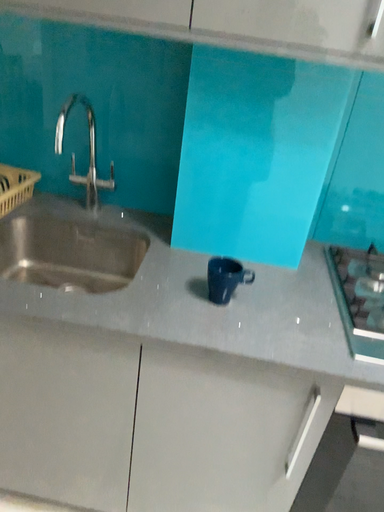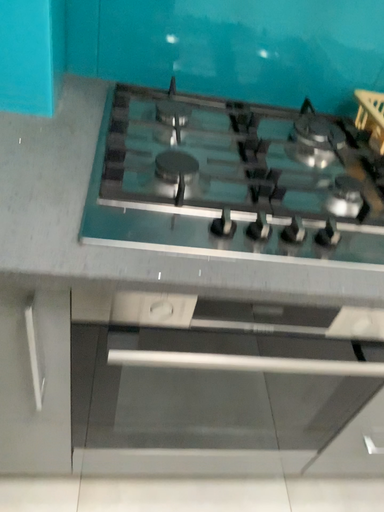
Question: How did the camera likely rotate when shooting the video?

Choices:
 (A) rotated upward
 (B) rotated downward

Answer: (B)